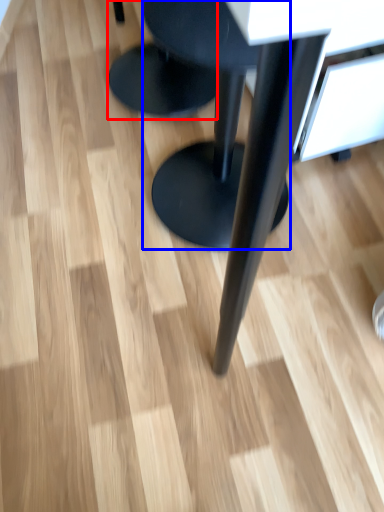
Question: Which object is closer to the camera taking this photo, stool (highlighted by a red box) or stool (highlighted by a blue box)?

Choices:
 (A) stool
 (B) stool

Answer: (B)